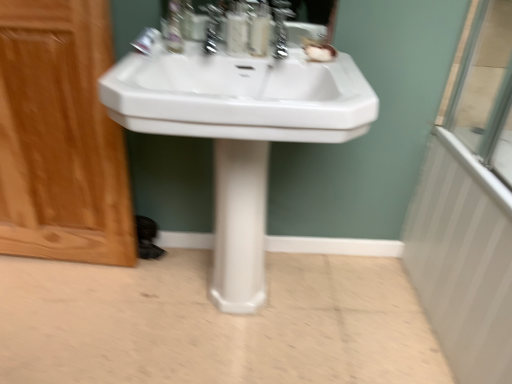
Where is `free space in front of white glossy pedestal at center`? The image size is (512, 384). free space in front of white glossy pedestal at center is located at coordinates (237, 337).